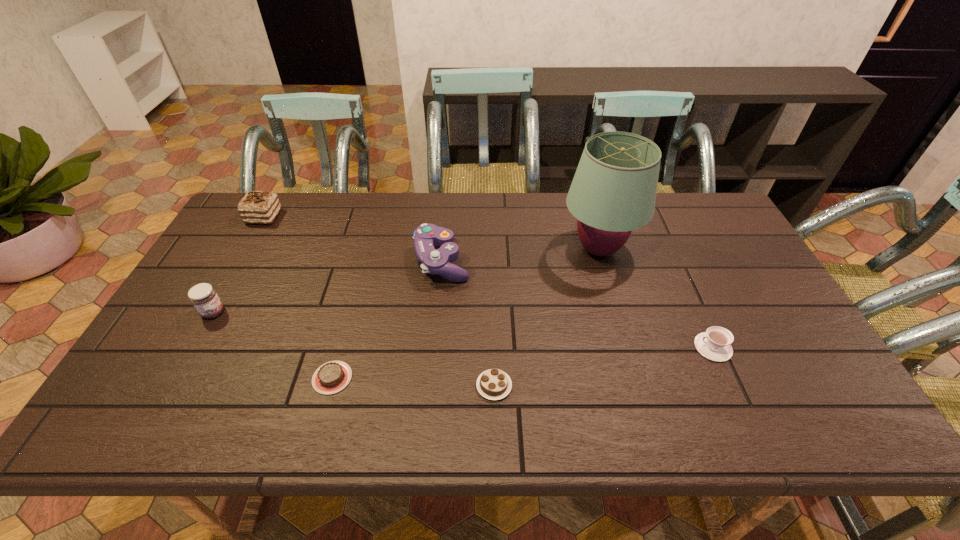
The image size is (960, 540). In order to click on chocolate cake that is at the far edge in this screenshot , I will do `click(257, 207)`.

Identify the location of object present at the near edge. (494, 384).

At what (x,y) coordinates should I click in order to perform the action: click on chocolate cake present at the left edge. Please return your answer as a coordinate pair (x, y). Image resolution: width=960 pixels, height=540 pixels. Looking at the image, I should click on (257, 207).

Identify the location of jam that is at the left edge. The width and height of the screenshot is (960, 540). (204, 298).

Find the location of a particular element. object present at the far left corner is located at coordinates [x=257, y=207].

Image resolution: width=960 pixels, height=540 pixels. Identify the location of vacant space at the far edge of the desktop. (505, 210).

Image resolution: width=960 pixels, height=540 pixels. I want to click on vacant space at the near edge of the desktop, so click(x=237, y=420).

The height and width of the screenshot is (540, 960). In order to click on blank area at the left edge in this screenshot , I will do click(x=170, y=382).

Identify the location of vacant area at the right edge of the desktop. (725, 284).

I want to click on free space between the tallest object and the third object from left to right, so click(x=466, y=313).